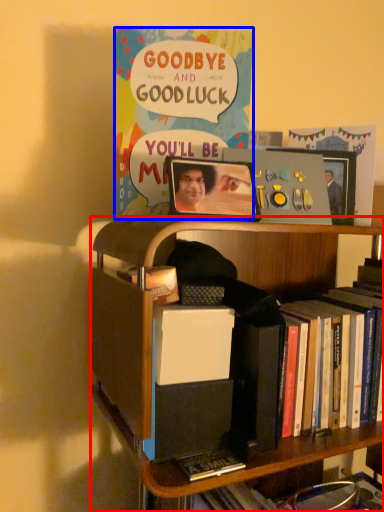
Question: Which object appears farthest to the camera in this image, bookcase (highlighted by a red box) or comic book (highlighted by a blue box)?

Choices:
 (A) bookcase
 (B) comic book

Answer: (B)